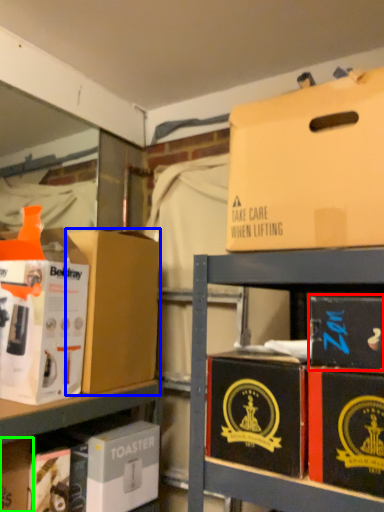
Question: Which object is the closest to the box (highlighted by a red box)? Choose among these: box (highlighted by a blue box) or storage box (highlighted by a green box).

Choices:
 (A) box
 (B) storage box

Answer: (A)